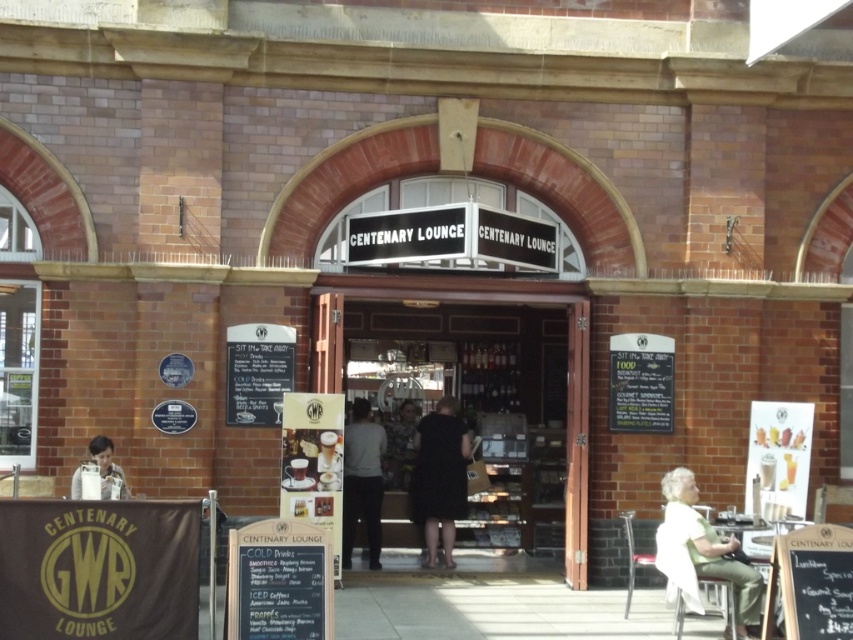
Question: Among these objects, which one is nearest to the camera?

Choices:
 (A) dark gray fabric jacket at center
 (B) white chalkboard at center
 (C) matte white plate at lower left

Answer: (B)

Question: Does black dress at center have a larger size compared to matte white plate at lower left?

Choices:
 (A) yes
 (B) no

Answer: (A)

Question: From the image, what is the correct spatial relationship of white fabric shirt at lower right in relation to matte white plate at lower left?

Choices:
 (A) above
 (B) below

Answer: (B)

Question: Does white fabric shirt at lower right have a lesser width compared to camouflage-patterned shirt at center?

Choices:
 (A) yes
 (B) no

Answer: (B)

Question: Among these points, which one is nearest to the camera?

Choices:
 (A) (273, 554)
 (B) (439, 458)
 (C) (399, 426)

Answer: (A)

Question: Among these objects, which one is farthest from the camera?

Choices:
 (A) black dress at center
 (B) wooden door at center

Answer: (A)